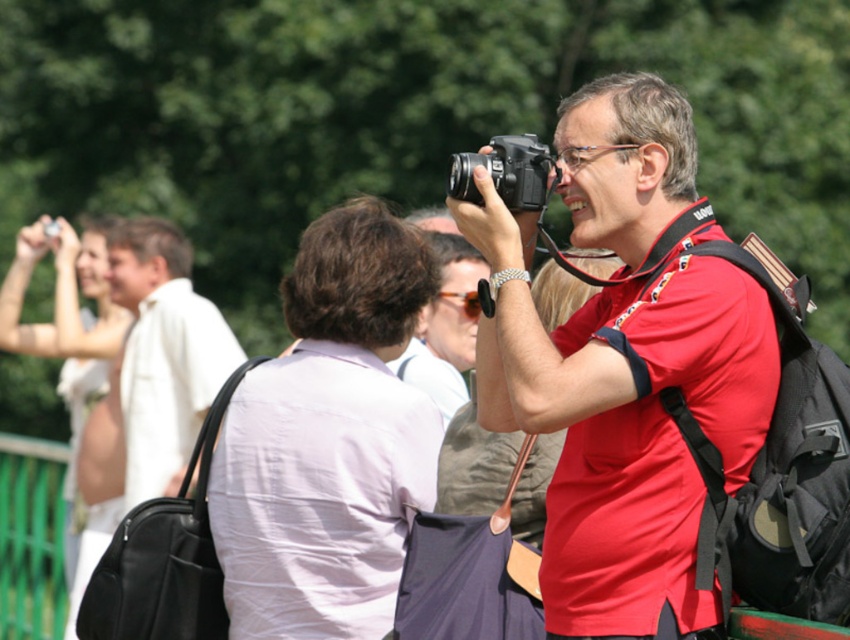
Does matte black camera at center appear on the right side of white matte shirt at upper left?

Yes, matte black camera at center is to the right of white matte shirt at upper left.

The image size is (850, 640). Describe the element at coordinates (622, 368) in the screenshot. I see `matte black camera at center` at that location.

Find the location of `matte black camera at center`. matte black camera at center is located at coordinates (622, 368).

Is white matte shirt at upper left positioned behind black plastic camera at center?

Yes.

Is point (197, 337) positioned before point (471, 164)?

No, (197, 337) is behind (471, 164).

Which is in front, point (168, 451) or point (450, 186)?

Point (450, 186) is more forward.

Identify the location of white matte shirt at upper left. (163, 352).

Is point (650, 589) less distant than point (449, 339)?

Yes, point (650, 589) is in front of point (449, 339).

Locate an element on the screen. matte black camera at center is located at coordinates (622, 368).

Which is behind, point (570, 484) or point (452, 241)?

The point (452, 241) is more distant.

The width and height of the screenshot is (850, 640). I want to click on matte black camera at center, so click(x=622, y=368).